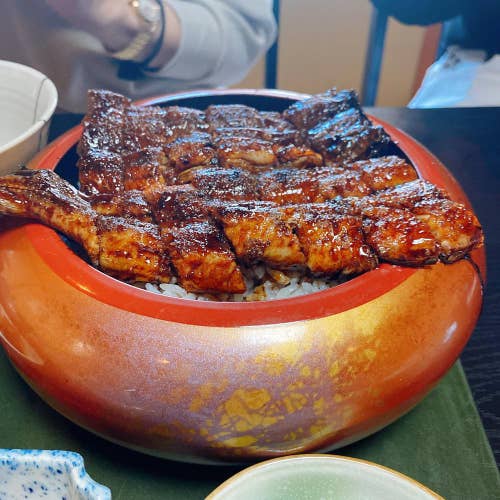
The image size is (500, 500). What are the coordinates of `tabletop` in the screenshot? It's located at (476, 139).